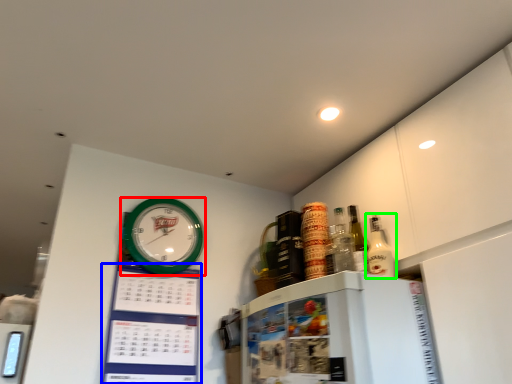
Question: Which object is the closest to the wall clock (highlighted by a red box)? Choose among these: bulletin board (highlighted by a blue box) or bottle (highlighted by a green box).

Choices:
 (A) bulletin board
 (B) bottle

Answer: (A)